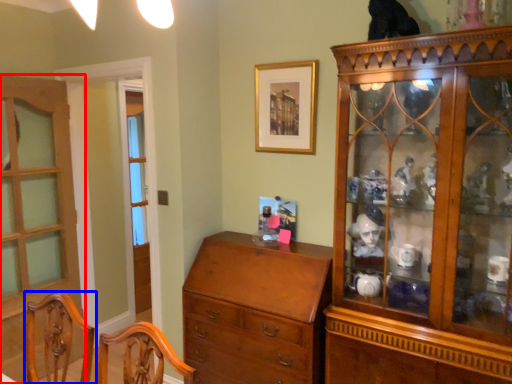
Question: Which object is closer to the camera taking this photo, door (highlighted by a red box) or chair (highlighted by a blue box)?

Choices:
 (A) door
 (B) chair

Answer: (B)